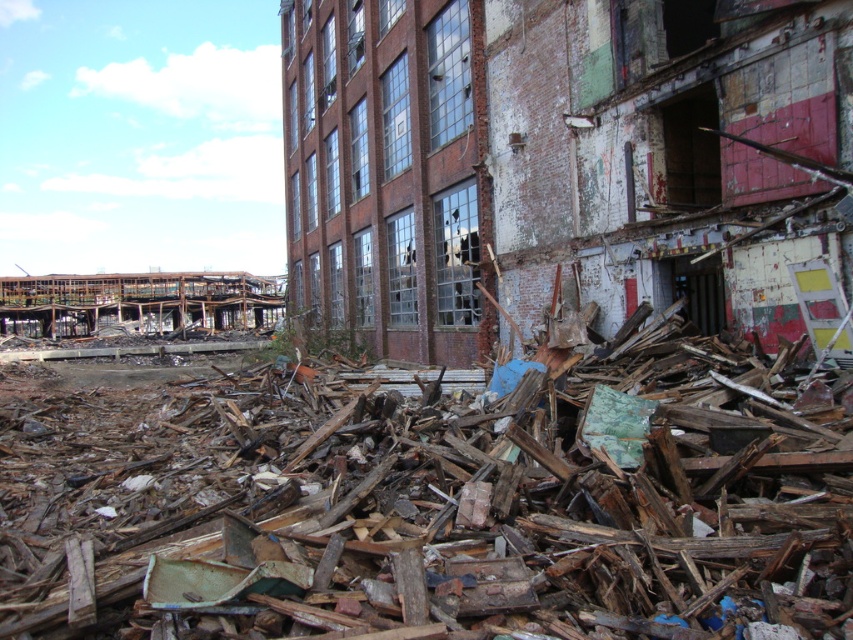
Between brown wood debris at center and crumbled brick wall at center, which one appears on the right side from the viewer's perspective?

From the viewer's perspective, crumbled brick wall at center appears more on the right side.

Is brown wood debris at center thinner than crumbled brick wall at center?

Correct, brown wood debris at center's width is less than crumbled brick wall at center's.

The height and width of the screenshot is (640, 853). I want to click on brown wood debris at center, so click(434, 502).

This screenshot has height=640, width=853. Identify the location of brown wood debris at center. (434, 502).